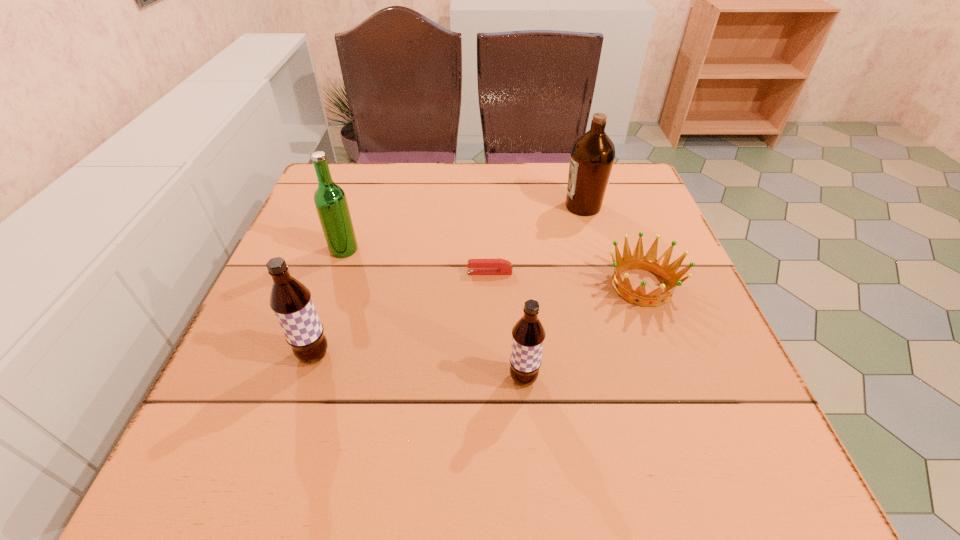
At what (x,y) coordinates should I click in order to perform the action: click on free location that satisfies the following two spatial constraints: 1. on the front-facing side of the second shortest object; 2. on the left side of the shortest object. Please return your answer as a coordinate pair (x, y). The height and width of the screenshot is (540, 960). Looking at the image, I should click on (491, 286).

What are the coordinates of `free space that satisfies the following two spatial constraints: 1. on the back side of the right root beer; 2. on the front-facing side of the stapler` in the screenshot? It's located at 515,273.

This screenshot has width=960, height=540. I want to click on free spot that satisfies the following two spatial constraints: 1. on the front-facing side of the fifth tallest object; 2. on the right side of the stapler, so click(x=491, y=286).

The width and height of the screenshot is (960, 540). What are the coordinates of `free space that satisfies the following two spatial constraints: 1. on the back side of the crown; 2. on the left side of the third shortest object` in the screenshot? It's located at (516, 286).